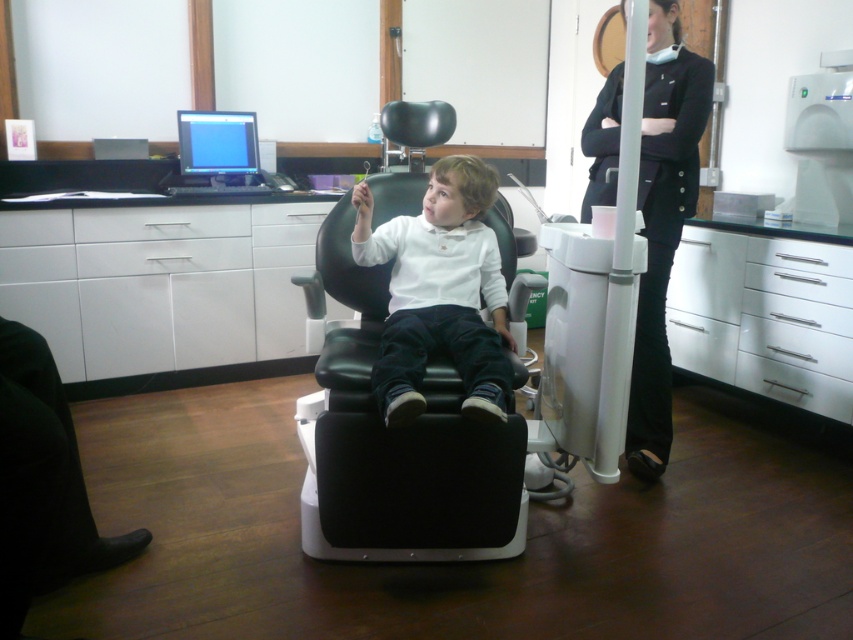
You are a dental assistant trying to organize the office. You need to place a new dental tool kit that requires 2 square feet of space. The black leather swivel chair at center and the white glossy shirt at center are in the way. Which object should you move first to free up enough space?

The black leather swivel chair at center is larger in size than the white glossy shirt at center, so you should move the black leather swivel chair at center first to free up enough space.

A dental assistant needs to move from the black leather swivel chair at center to the dental professional on the right. The assistant is carrying a tray that requires them to walk in a straight line. Is there enough space between them to move comfortably?

The dental assistant and the dental professional are 1.76 meters apart. Since the distance between them is sufficient, the assistant can move comfortably in a straight line without any issues.

You are a dental assistant who needs to place a small tool in the white glossy drawer at center and then hand it to the patient in the black fabric pants at right. Can you reach the drawer before the pants?

The white glossy drawer at center is wider than the black fabric pants at right, so yes, you can reach the drawer before reaching the pants.